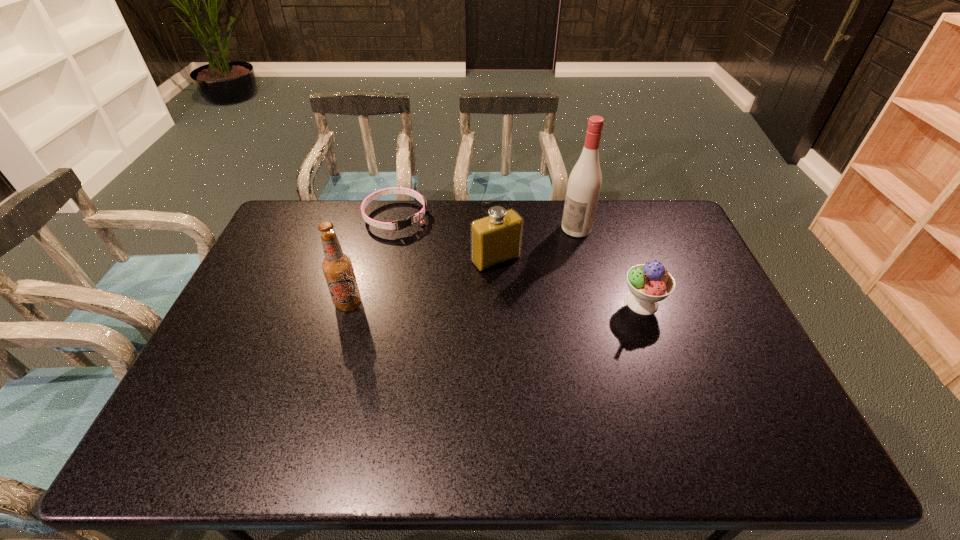
This screenshot has height=540, width=960. Find the location of `vacant spot on the desktop that is between the fourth shortest object and the rightmost object and is positioned on the front-facing side of the third tallest object`. vacant spot on the desktop that is between the fourth shortest object and the rightmost object and is positioned on the front-facing side of the third tallest object is located at coordinates (532, 303).

Identify the location of free space on the desktop that is between the second tallest object and the rightmost object and is positioned with the buckle on the dog collar. Image resolution: width=960 pixels, height=540 pixels. (462, 303).

You are a GUI agent. You are given a task and a screenshot of the screen. Output one action in this format:
    pyautogui.click(x=<x>, y=<y>)
    Task: Click on the free spot on the desktop that is between the beer bottle and the icecream and is positioned on the label of the fourth object from left to right
    
    Given the screenshot: What is the action you would take?
    pyautogui.click(x=467, y=303)